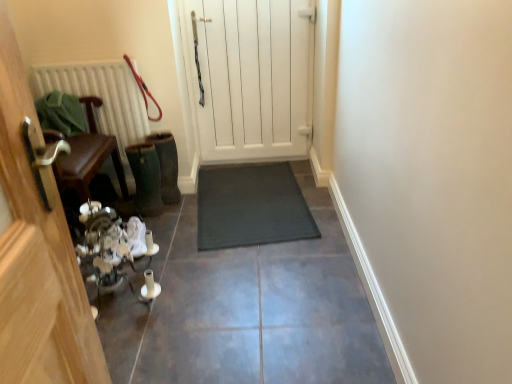
Question: From the image's perspective, is white wooden door at center, arranged as the 1th door when viewed from the right, positioned above or below dark gray rubber mat at center?

Choices:
 (A) below
 (B) above

Answer: (B)

Question: Is white wooden door at center, marked as the 2th door in a left-to-right arrangement, in front of or behind dark gray rubber mat at center in the image?

Choices:
 (A) behind
 (B) front

Answer: (A)

Question: Estimate the real-world distances between objects in this image. Which object is closer to the dark gray rubber mat at center?

Choices:
 (A) white textured radiator at left
 (B) wooden chair at left, acting as the first door starting from the front
 (C) dark gray rubber mat at center
 (D) red leather leash at upper left
 (E) white wooden door at center, marked as the 2th door in a left-to-right arrangement

Answer: (C)

Question: Estimate the real-world distances between objects in this image. Which object is closer to the red leather leash at upper left?

Choices:
 (A) dark gray rubber mat at center
 (B) wooden chair at left, the second door from the right
 (C) dark gray rubber mat at center
 (D) white wooden door at center, arranged as the 1th door when viewed from the right
 (E) white textured radiator at left

Answer: (E)